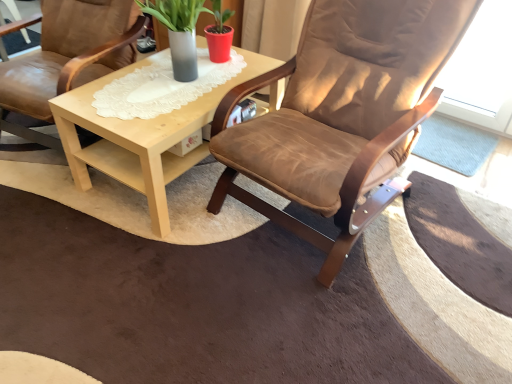
Question: Is matte gray vase at center at the back of brown leather chair at center, acting as the second chair starting from the right?

Choices:
 (A) yes
 (B) no

Answer: (B)

Question: Can you confirm if brown leather chair at center, marked as the first chair in a left-to-right arrangement, is taller than matte gray vase at center?

Choices:
 (A) no
 (B) yes

Answer: (B)

Question: Considering the relative positions of brown leather chair at center, acting as the second chair starting from the right, and matte gray vase at center in the image provided, is brown leather chair at center, acting as the second chair starting from the right, to the left of matte gray vase at center from the viewer's perspective?

Choices:
 (A) yes
 (B) no

Answer: (A)

Question: Can you confirm if brown leather chair at center, marked as the first chair in a left-to-right arrangement, is positioned to the right of matte gray vase at center?

Choices:
 (A) no
 (B) yes

Answer: (A)

Question: Can you confirm if brown leather chair at center, acting as the second chair starting from the right, is bigger than matte gray vase at center?

Choices:
 (A) no
 (B) yes

Answer: (B)

Question: From their relative heights in the image, would you say brown suede chair at center, which appears as the first chair when viewed from the right, is taller or shorter than brown leather chair at center, marked as the first chair in a left-to-right arrangement?

Choices:
 (A) tall
 (B) short

Answer: (A)

Question: Is brown suede chair at center, which appears as the first chair when viewed from the right, inside the boundaries of brown leather chair at center, acting as the second chair starting from the right, or outside?

Choices:
 (A) inside
 (B) outside

Answer: (B)

Question: From a real-world perspective, relative to brown leather chair at center, acting as the second chair starting from the right, is brown suede chair at center, the second chair when ordered from left to right, vertically above or below?

Choices:
 (A) above
 (B) below

Answer: (A)

Question: Based on their positions, is brown suede chair at center, which appears as the first chair when viewed from the right, located to the left or right of brown leather chair at center, acting as the second chair starting from the right?

Choices:
 (A) left
 (B) right

Answer: (B)

Question: From the image's perspective, is light wood/texture coffee table at center positioned above or below brown leather chair at center, acting as the second chair starting from the right?

Choices:
 (A) above
 (B) below

Answer: (B)

Question: Is point (208, 94) closer or farther from the camera than point (135, 34)?

Choices:
 (A) farther
 (B) closer

Answer: (B)

Question: Considering the relative positions of light wood/texture coffee table at center and brown leather chair at center, acting as the second chair starting from the right, in the image provided, is light wood/texture coffee table at center to the left or to the right of brown leather chair at center, acting as the second chair starting from the right,?

Choices:
 (A) right
 (B) left

Answer: (A)

Question: Considering the positions of light wood/texture coffee table at center and brown leather chair at center, acting as the second chair starting from the right, in the image, is light wood/texture coffee table at center wider or thinner than brown leather chair at center, acting as the second chair starting from the right,?

Choices:
 (A) thin
 (B) wide

Answer: (B)

Question: Considering their positions, is matte gray vase at center located in front of or behind brown suede chair at center, which appears as the first chair when viewed from the right?

Choices:
 (A) front
 (B) behind

Answer: (B)

Question: Looking at the image, does matte gray vase at center seem bigger or smaller compared to brown suede chair at center, the second chair when ordered from left to right?

Choices:
 (A) big
 (B) small

Answer: (B)